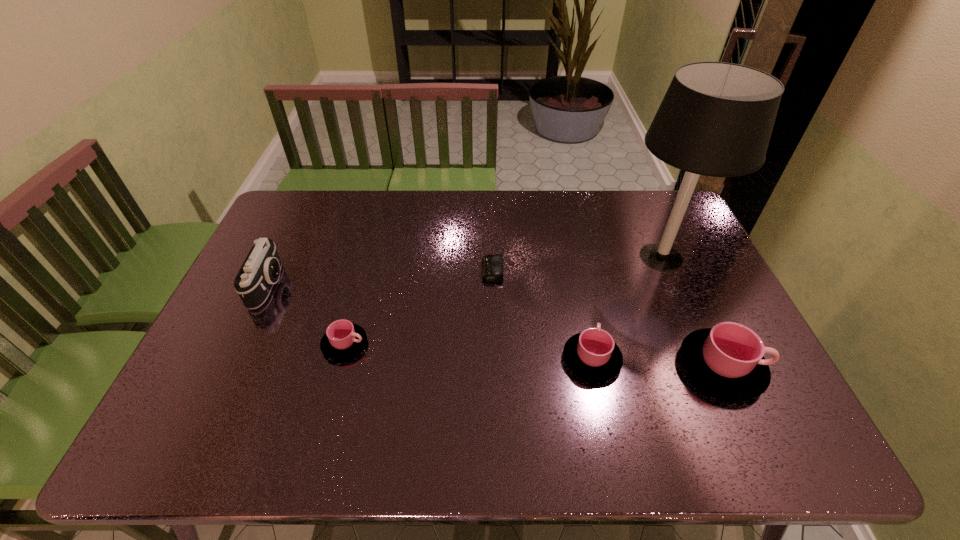
This screenshot has width=960, height=540. Identify the location of the tallest object. (716, 119).

The image size is (960, 540). In order to click on vacant space located on the side with the handle of the leftmost cup in this screenshot , I will do point(515,344).

The height and width of the screenshot is (540, 960). I want to click on vacant region located on the side with the handle of the second shortest cup, so click(583, 316).

What are the coordinates of `free spot located 0.390m on the side with the handle of the second shortest cup` in the screenshot? It's located at (566, 242).

The image size is (960, 540). Find the location of `free location located 0.110m on the side with the handle of the second shortest cup`. free location located 0.110m on the side with the handle of the second shortest cup is located at coordinates (580, 305).

Locate an element on the screen. The image size is (960, 540). vacant space situated on the front lens of the leftmost object is located at coordinates (388, 285).

The width and height of the screenshot is (960, 540). In order to click on free space located on the display of the alarm clock in this screenshot , I will do `click(372, 271)`.

I want to click on vacant space located 0.240m on the display of the alarm clock, so click(x=404, y=271).

Where is `vacant space located on the display of the alarm clock`? This screenshot has width=960, height=540. vacant space located on the display of the alarm clock is located at coordinates click(352, 271).

Image resolution: width=960 pixels, height=540 pixels. I want to click on free location located 0.290m on the front of the tallest object, so click(x=712, y=375).